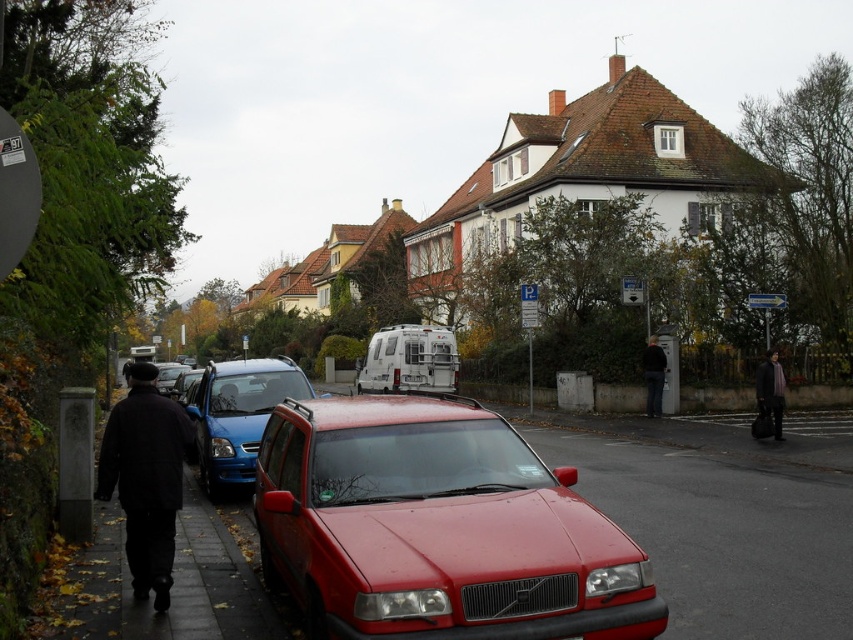
You are standing at the center of the residential street and see the black woolen coat at left. Which direction should you walk to reach it?

The black woolen coat at left is located to your left side, so you should walk towards the left to reach it.